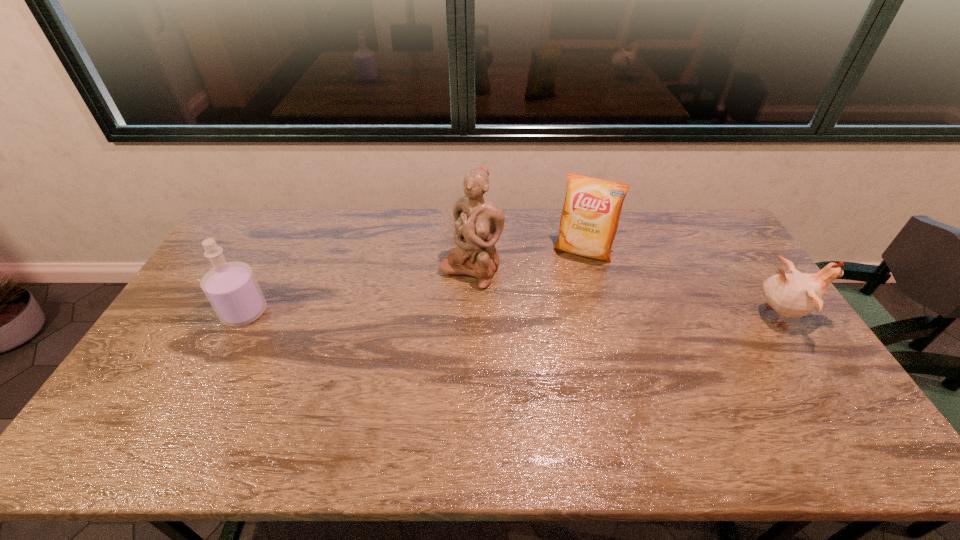
At what (x,y) coordinates should I click in order to perform the action: click on free spot on the desktop that is between the perfume and the rightmost object and is positioned on the front-facing side of the crisp (potato chip). Please return your answer as a coordinate pair (x, y). Looking at the image, I should click on (561, 315).

This screenshot has height=540, width=960. Identify the location of free space on the desktop that is between the perfume and the shortest object and is positioned on the front-facing side of the figurine. (433, 314).